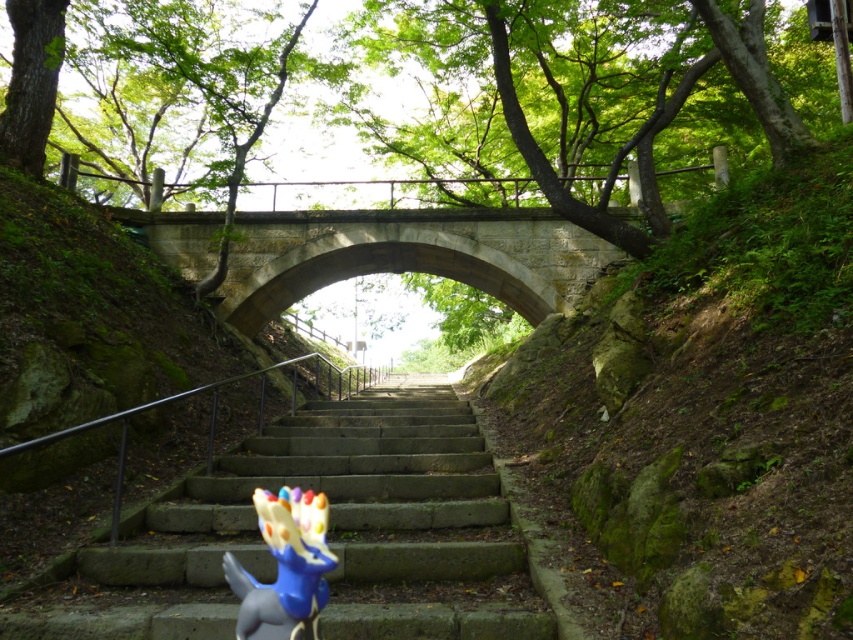
You are standing at the base of the stone staircase looking up towards the bridge. There are two points marked on the image, one at coordinates point (712,376) and the other at point (337,488). Which point is closer to you?

Point (712,376) is closer to the viewer than point (337,488).

Consider the image. You are a delivery person carrying a large package that is 16 feet long. You need to move it through the space between the stone stairs at center. Can you fit the package through that space?

The space between the stone stairs at center is 15.77 feet apart, which is slightly narrower than the 16 feet long package. Therefore, the package cannot fit through the space between the stone stairs at center.